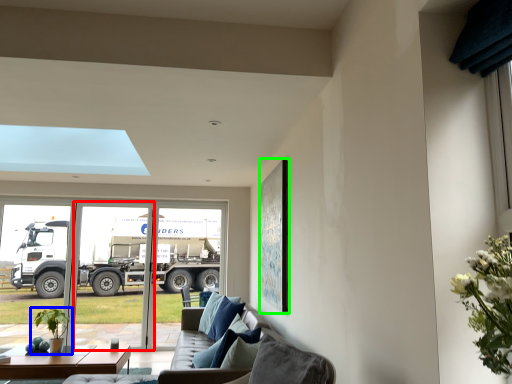
Question: Estimate the real-world distances between objects in this image. Which object is closer to screen door (highlighted by a red box), houseplant (highlighted by a blue box) or picture frame (highlighted by a green box)?

Choices:
 (A) houseplant
 (B) picture frame

Answer: (A)